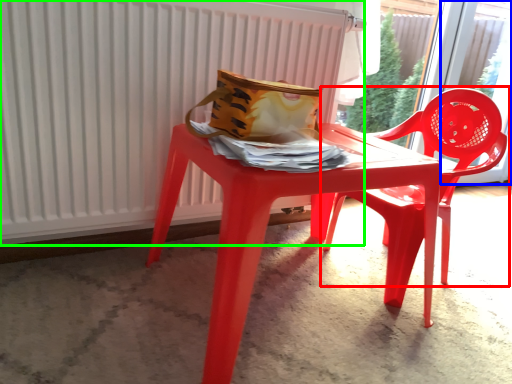
Question: Estimate the real-world distances between objects in this image. Which object is closer to chair (highlighted by a red box), window (highlighted by a blue box) or radiator (highlighted by a green box)?

Choices:
 (A) window
 (B) radiator

Answer: (B)